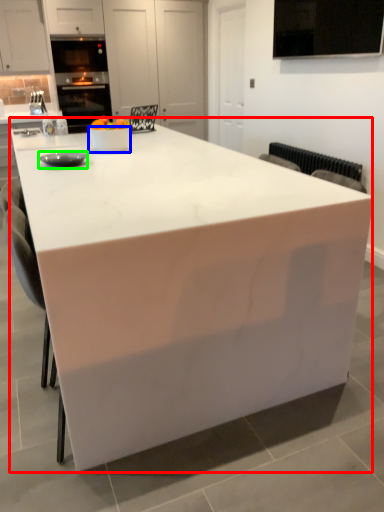
Question: Which is nearer to the table (highlighted by a red box)? bowl (highlighted by a blue box) or appliance (highlighted by a green box).

Choices:
 (A) bowl
 (B) appliance

Answer: (B)